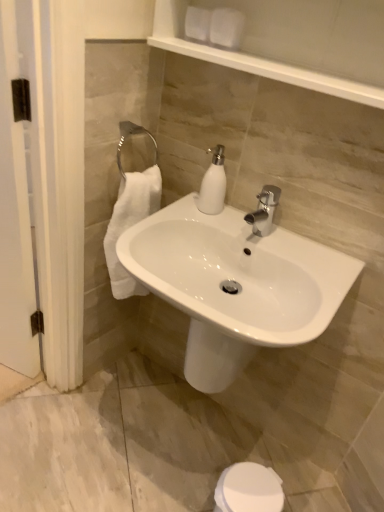
Measure the distance between white glossy sink at center and camera.

They are 33.49 inches apart.

Identify the location of white glossy soap dispenser at center. The width and height of the screenshot is (384, 512). (213, 183).

The width and height of the screenshot is (384, 512). Find the location of `white matte toilet paper at upper center`. white matte toilet paper at upper center is located at coordinates (226, 28).

Which of these two, white matte toilet paper at upper center or white wood screen door at left, stands shorter?

white matte toilet paper at upper center is shorter.

In the scene shown: Is white matte toilet paper at upper center inside or outside of white wood screen door at left?

white matte toilet paper at upper center is not enclosed by white wood screen door at left.

Is white matte toilet paper at upper center wider than white wood screen door at left?

Incorrect, the width of white matte toilet paper at upper center does not surpass that of white wood screen door at left.

Is white matte toilet paper at upper center facing away from white wood screen door at left?

No, white matte toilet paper at upper center is not facing the opposite direction of white wood screen door at left.

Does point (204, 179) appear closer or farther from the camera than point (228, 16)?

Point (204, 179) appears to be farther away from the viewer than point (228, 16).

From the image's perspective, is white glossy soap dispenser at center positioned above or below white matte toilet paper at upper center?

From the image's perspective, white glossy soap dispenser at center appears below white matte toilet paper at upper center.

From a real-world perspective, relative to white matte toilet paper at upper center, is white glossy soap dispenser at center vertically above or below?

In terms of real-world spatial position, white glossy soap dispenser at center is below white matte toilet paper at upper center.

Is white glossy soap dispenser at center not near white matte toilet paper at upper center?

No, white glossy soap dispenser at center is not far away from white matte toilet paper at upper center.

Considering the positions of points (234, 29) and (213, 160), is point (234, 29) closer to camera compared to point (213, 160)?

Yes, it is in front of point (213, 160).

Which is in front, white matte toilet paper at upper center or white glossy soap dispenser at center?

white matte toilet paper at upper center is in front.

Is white matte toilet paper at upper center facing away from white glossy soap dispenser at center?

No, white matte toilet paper at upper center is not facing away from white glossy soap dispenser at center.

Considering the sizes of white matte toilet paper at upper center and white glossy soap dispenser at center in the image, is white matte toilet paper at upper center wider or thinner than white glossy soap dispenser at center?

In the image, white matte toilet paper at upper center appears to be more narrow than white glossy soap dispenser at center.

Locate an element on the screen. The width and height of the screenshot is (384, 512). sink below the white glossy soap dispenser at center (from the image's perspective) is located at coordinates (235, 285).

Can you confirm if white glossy soap dispenser at center is positioned to the right of white glossy sink at center?

Yes, white glossy soap dispenser at center is to the right of white glossy sink at center.

How different are the orientations of white glossy soap dispenser at center and white glossy sink at center in degrees?

There is a 0.00183-degree angle between the facing directions of white glossy soap dispenser at center and white glossy sink at center.

Can you confirm if white glossy soap dispenser at center is thinner than white glossy sink at center?

Indeed, white glossy soap dispenser at center has a lesser width compared to white glossy sink at center.

I want to click on toilet paper above the white glossy sink at center (from the image's perspective), so tap(226, 28).

Between white glossy sink at center and white matte toilet paper at upper center, which one has less height?

white matte toilet paper at upper center.

Considering the positions of objects white glossy sink at center and white matte toilet paper at upper center in the image provided, who is more to the left, white glossy sink at center or white matte toilet paper at upper center?

white glossy sink at center.

From the image's perspective, is white glossy sink at center under white matte toilet paper at upper center?

Yes.

Consider the image. From a real-world perspective, does white matte toilet paper at upper center sit lower than white glossy sink at center?

No.

Considering the sizes of objects white matte toilet paper at upper center and white glossy sink at center in the image provided, who is thinner, white matte toilet paper at upper center or white glossy sink at center?

white matte toilet paper at upper center is thinner.

Is white matte toilet paper at upper center turned away from white glossy sink at center?

No, white matte toilet paper at upper center is not facing away from white glossy sink at center.

At what (x,y) coordinates should I click in order to perform the action: click on sink lying in front of the white matte toilet paper at upper center. Please return your answer as a coordinate pair (x, y). Image resolution: width=384 pixels, height=512 pixels. Looking at the image, I should click on (235, 285).

Between white glossy soap dispenser at center and white wood screen door at left, which one is positioned in front?

Positioned in front is white wood screen door at left.

Is white glossy soap dispenser at center bigger than white wood screen door at left?

No, white glossy soap dispenser at center is not bigger than white wood screen door at left.

Considering the sizes of objects white glossy soap dispenser at center and white wood screen door at left in the image provided, who is thinner, white glossy soap dispenser at center or white wood screen door at left?

white wood screen door at left.

Is white glossy soap dispenser at center situated inside white wood screen door at left or outside?

white glossy soap dispenser at center cannot be found inside white wood screen door at left.

Where is `screen door that is below the white matte toilet paper at upper center (from the image's perspective)`? Image resolution: width=384 pixels, height=512 pixels. screen door that is below the white matte toilet paper at upper center (from the image's perspective) is located at coordinates (15, 216).

At what (x,y) coordinates should I click in order to perform the action: click on soap dispenser located on the left of white matte toilet paper at upper center. Please return your answer as a coordinate pair (x, y). Looking at the image, I should click on (213, 183).

In the scene shown: Which object lies further to the anchor point white wood screen door at left, white glossy soap dispenser at center or white matte toilet paper at upper center?

Based on the image, white matte toilet paper at upper center appears to be further to white wood screen door at left.

Based on their spatial positions, is white wood screen door at left or white matte toilet paper at upper center closer to white glossy soap dispenser at center?

Based on the image, white matte toilet paper at upper center appears to be nearer to white glossy soap dispenser at center.

Based on the photo, looking at the image, which one is located closer to white matte toilet paper at upper center, white glossy sink at center or white glossy soap dispenser at center?

Based on the image, white glossy soap dispenser at center appears to be nearer to white matte toilet paper at upper center.

From the image, which object appears to be nearer to white matte toilet paper at upper center, white glossy sink at center or white wood screen door at left?

Based on the image, white glossy sink at center appears to be nearer to white matte toilet paper at upper center.

Which object lies nearer to the anchor point white glossy soap dispenser at center, white matte toilet paper at upper center or white glossy sink at center?

white glossy sink at center lies closer to white glossy soap dispenser at center than the other object.

From the image, which object appears to be nearer to white wood screen door at left, white glossy soap dispenser at center or white glossy sink at center?

Based on the image, white glossy soap dispenser at center appears to be nearer to white wood screen door at left.

Looking at the image, which one is located closer to white matte toilet paper at upper center, white wood screen door at left or white glossy soap dispenser at center?

white glossy soap dispenser at center is positioned closer to the anchor white matte toilet paper at upper center.

Which object lies further to the anchor point white glossy sink at center, white matte toilet paper at upper center or white glossy soap dispenser at center?

white matte toilet paper at upper center is further to white glossy sink at center.

Find the location of a particular element. The height and width of the screenshot is (512, 384). sink between white wood screen door at left and white glossy soap dispenser at center in the horizontal direction is located at coordinates (235, 285).

Where is `soap dispenser between white matte toilet paper at upper center and white glossy sink at center in the vertical direction`? The height and width of the screenshot is (512, 384). soap dispenser between white matte toilet paper at upper center and white glossy sink at center in the vertical direction is located at coordinates (213, 183).

Locate an element on the screen. soap dispenser situated between white wood screen door at left and white matte toilet paper at upper center from left to right is located at coordinates (213, 183).

This screenshot has height=512, width=384. In order to click on screen door between white matte toilet paper at upper center and white glossy sink at center from top to bottom in this screenshot , I will do `click(15, 216)`.